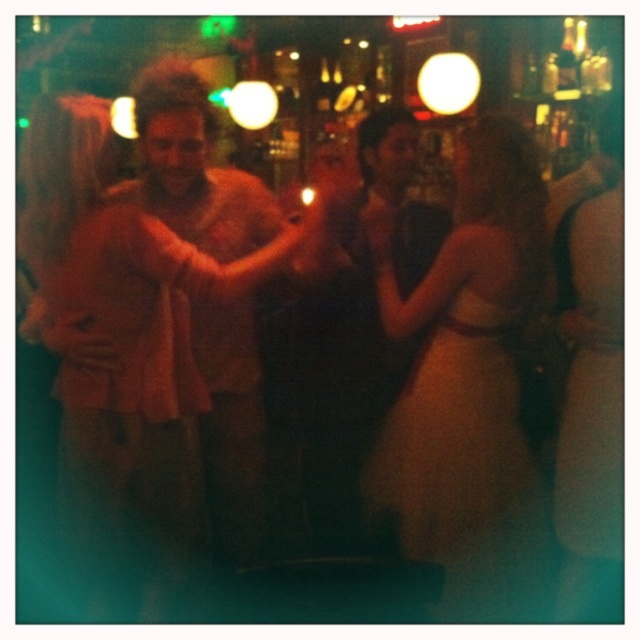
Which is below, matte beige dress at center or light brown leather jacket at center?

light brown leather jacket at center is below.

Can you confirm if matte beige dress at center is positioned below light brown leather jacket at center?

Actually, matte beige dress at center is above light brown leather jacket at center.

You are a GUI agent. You are given a task and a screenshot of the screen. Output one action in this format:
    pyautogui.click(x=<x>, y=<y>)
    Task: Click on the matte beige dress at center
    
    Given the screenshot: What is the action you would take?
    pyautogui.click(x=122, y=333)

Is silky beige dress at center to the left of light brown leather jacket at center from the viewer's perspective?

Yes, silky beige dress at center is to the left of light brown leather jacket at center.

Does silky beige dress at center have a greater height compared to light brown leather jacket at center?

No, silky beige dress at center is not taller than light brown leather jacket at center.

Based on the photo, who is more forward, (522, 150) or (573, 211)?

Point (522, 150)

Identify the location of silky beige dress at center. Image resolution: width=640 pixels, height=640 pixels. (467, 376).

Between matte beige dress at center and silky beige dress at center, which one is positioned higher?

matte beige dress at center is above.

Which of these two, matte beige dress at center or silky beige dress at center, stands shorter?

matte beige dress at center is shorter.

Does point (216, 288) come closer to viewer compared to point (426, 477)?

Yes, it is in front of point (426, 477).

Identify the location of matte beige dress at center. The height and width of the screenshot is (640, 640). (122, 333).